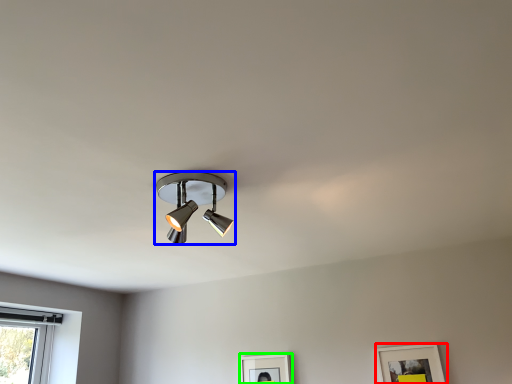
Question: Which object is positioned farthest from picture frame (highlighted by a red box)? Select from lamp (highlighted by a blue box) and picture frame (highlighted by a green box).

Choices:
 (A) lamp
 (B) picture frame

Answer: (A)